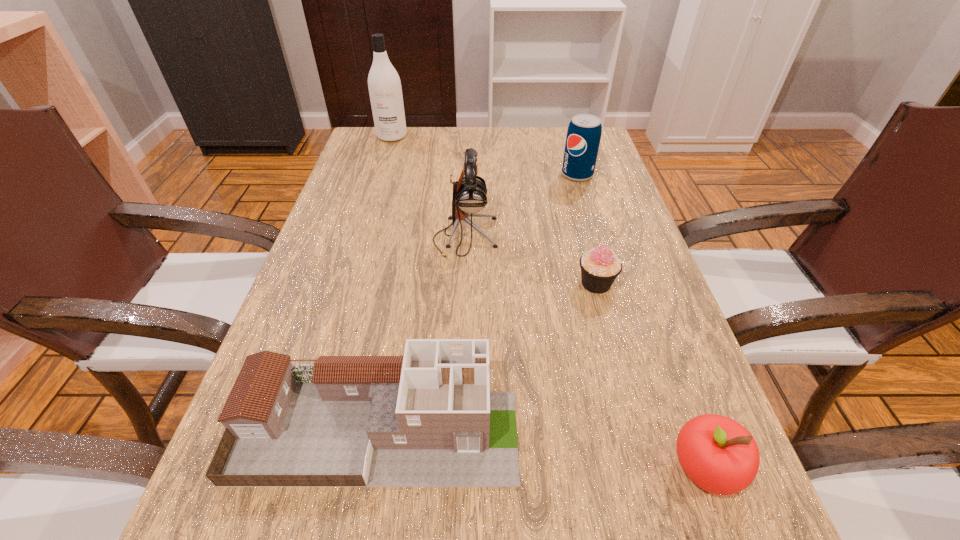
Where is `vacant space located on the left of the earphone`? vacant space located on the left of the earphone is located at coordinates (349, 237).

You are a GUI agent. You are given a task and a screenshot of the screen. Output one action in this format:
    pyautogui.click(x=<x>, y=<y>)
    Task: Click on the free spot located on the left of the pop
    The image size is (960, 540).
    Given the screenshot: What is the action you would take?
    pyautogui.click(x=466, y=174)

In order to click on free space located at the main entrance of the dollhouse in this screenshot , I will do `click(549, 428)`.

The width and height of the screenshot is (960, 540). Identify the location of vacant space located on the back of the apple. (644, 303).

Where is `vacant position located on the front of the fourth farthest object`? vacant position located on the front of the fourth farthest object is located at coordinates (660, 519).

Where is `shampoo at the far edge`? The image size is (960, 540). shampoo at the far edge is located at coordinates (384, 84).

Where is `pop located at the far edge`? The height and width of the screenshot is (540, 960). pop located at the far edge is located at coordinates (583, 137).

I want to click on shampoo situated at the left edge, so click(x=384, y=84).

Identify the location of dollhouse that is positioned at the left edge. (426, 419).

Identify the location of pop that is at the right edge. (583, 137).